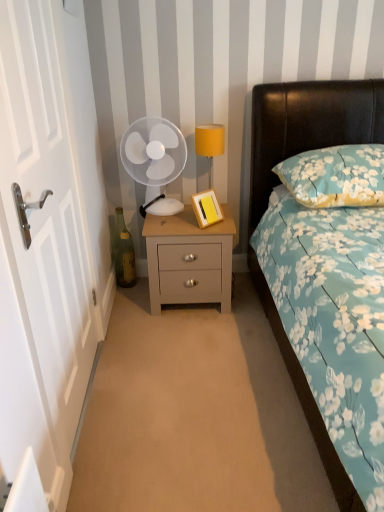
The image size is (384, 512). I want to click on vacant space that is in between matte gray nightstand at center and white wooden door at left, so click(x=150, y=349).